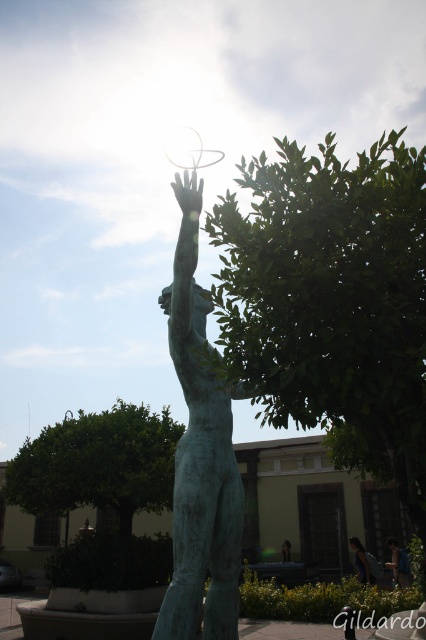
Question: Which is nearer to the green leafy tree at lower left?

Choices:
 (A) green leafy tree at center
 (B) dark blue jeans at lower center
 (C) blue-green statue at center

Answer: (A)

Question: Among these points, which one is nearest to the camera?

Choices:
 (A) (420, 451)
 (B) (86, 445)

Answer: (A)

Question: Can you confirm if blue-green statue at center is thinner than dark blue jeans at lower center?

Choices:
 (A) yes
 (B) no

Answer: (A)

Question: Where is green patina statue at center located in relation to green leafy tree at lower left in the image?

Choices:
 (A) above
 (B) below

Answer: (A)

Question: Which object is positioned farthest from the dark blue jeans at lower center?

Choices:
 (A) green leafy tree at lower left
 (B) blue-green statue at center

Answer: (A)

Question: Can you confirm if green leafy tree at center is bigger than dark blue jeans at lower center?

Choices:
 (A) no
 (B) yes

Answer: (B)